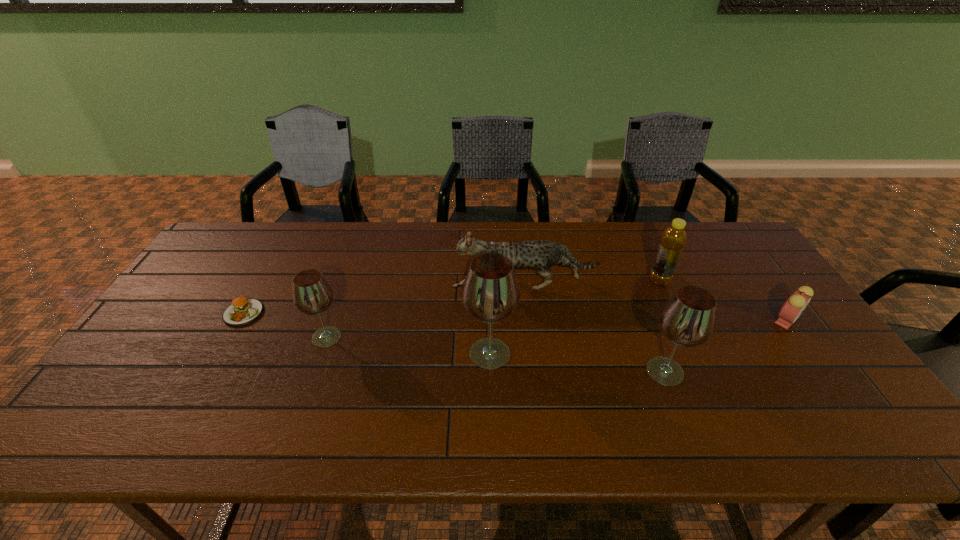
Identify the location of the leftmost wineglass. (312, 294).

I want to click on the shortest wineglass, so click(x=312, y=294).

I want to click on the second wineglass from right to left, so click(x=490, y=294).

Where is `the second tallest wineglass`? The image size is (960, 540). the second tallest wineglass is located at coordinates (688, 318).

In order to click on bottle in this screenshot , I will do `click(673, 239)`.

Locate an element on the screen. This screenshot has height=540, width=960. cat is located at coordinates click(540, 255).

This screenshot has width=960, height=540. I want to click on the leftmost object, so click(x=243, y=310).

Locate an element on the screen. the shortest object is located at coordinates (243, 310).

The image size is (960, 540). Find the location of `the sixth tallest object`. the sixth tallest object is located at coordinates (792, 308).

Where is `the rightmost object`? the rightmost object is located at coordinates (792, 308).